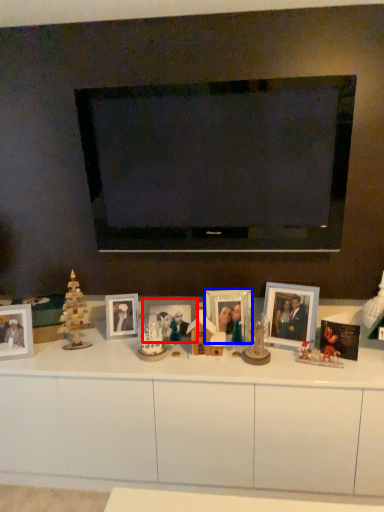
Question: Which object appears closest to the camera in this image, picture frame (highlighted by a red box) or picture frame (highlighted by a blue box)?

Choices:
 (A) picture frame
 (B) picture frame

Answer: (B)